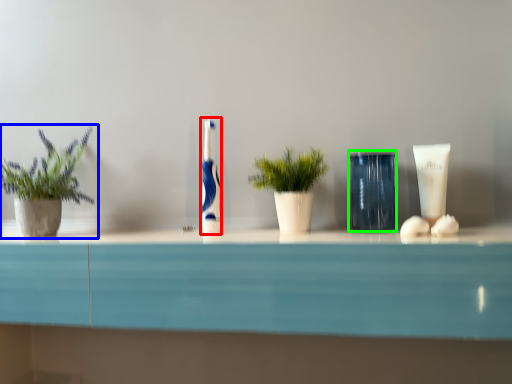
Question: Based on their relative distances, which object is farther from toothbrush (highlighted by a red box)? Choose from houseplant (highlighted by a blue box) and glass vase (highlighted by a green box).

Choices:
 (A) houseplant
 (B) glass vase

Answer: (A)